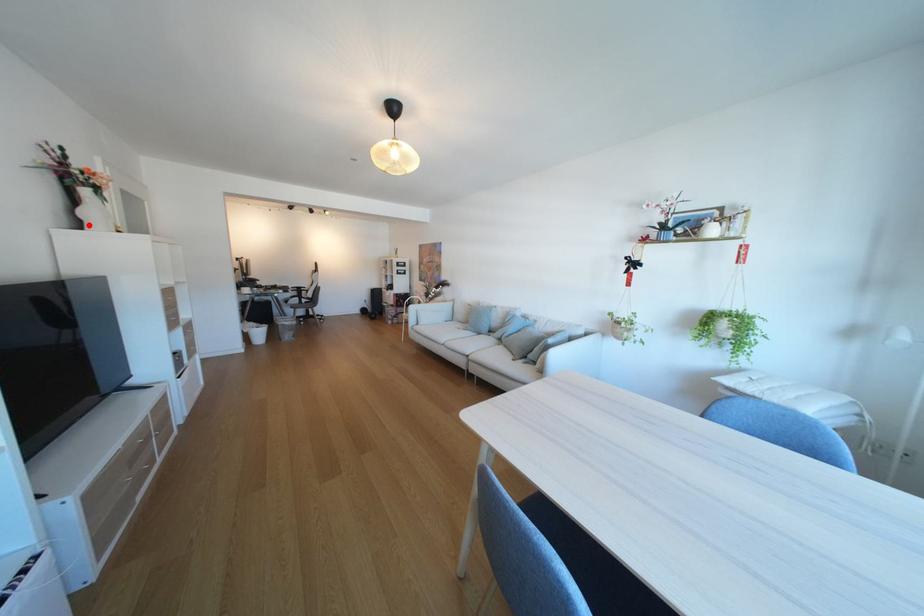
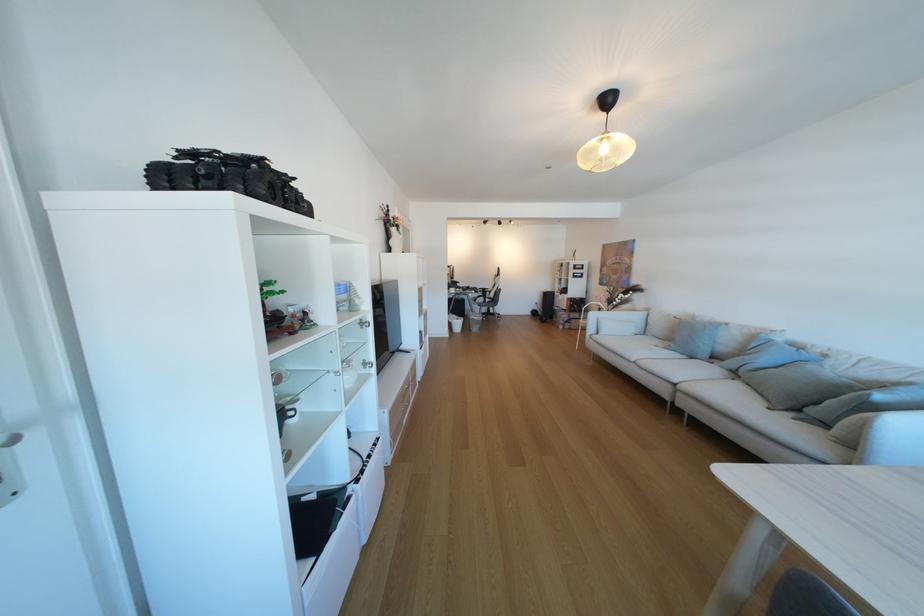
Find the pixel in the second image that matches the highlighted location in the first image.

(400, 251)